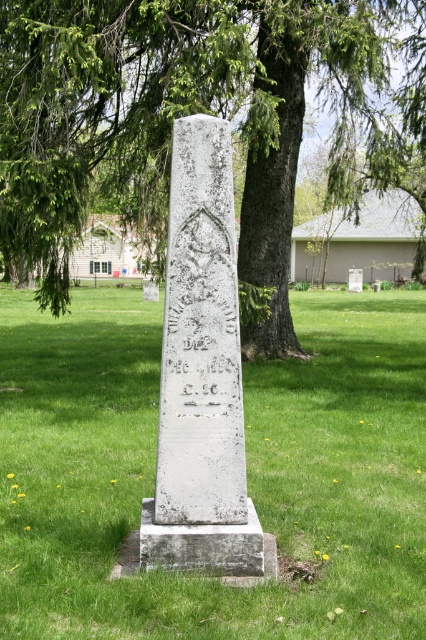
Does green leafy tree at center have a smaller size compared to white stone monument at center?

Actually, green leafy tree at center might be larger than white stone monument at center.

Between green leafy tree at center and white stone monument at center, which one has more height?

Standing taller between the two is green leafy tree at center.

Locate an element on the screen. The height and width of the screenshot is (640, 426). green leafy tree at center is located at coordinates (199, 112).

In order to click on green leafy tree at center in this screenshot , I will do `click(199, 112)`.

Does green grass at center have a greater height compared to white stone monument at center?

Incorrect, green grass at center's height is not larger of white stone monument at center's.

Who is more distant from viewer, [74,424] or [230,204]?

Positioned behind is point [74,424].

Does point (319, 435) lie in front of point (161, 461)?

No, (319, 435) is further to viewer.

Locate an element on the screen. The width and height of the screenshot is (426, 640). green grass at center is located at coordinates (247, 465).

Does green grass at center have a greater width compared to green leafy tree at center?

In fact, green grass at center might be narrower than green leafy tree at center.

Does point (344, 310) come behind point (348, 109)?

Yes, point (344, 310) is farther from viewer.

Does point (134, 321) lie in front of point (37, 76)?

No, (134, 321) is behind (37, 76).

You are a GUI agent. You are given a task and a screenshot of the screen. Output one action in this format:
    pyautogui.click(x=<x>, y=<y>)
    Task: Click on the green grass at center
    Image resolution: width=426 pixels, height=640 pixels.
    Given the screenshot: What is the action you would take?
    pyautogui.click(x=247, y=465)